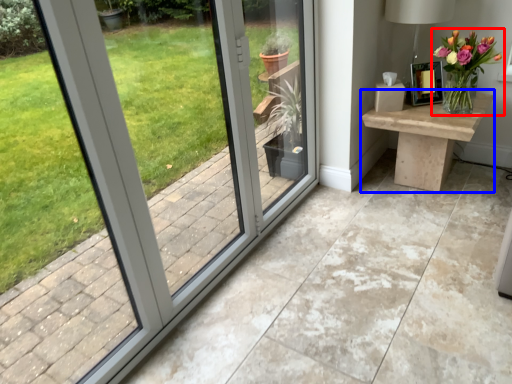
Question: Which object is closer to the camera taking this photo, houseplant (highlighted by a red box) or table (highlighted by a blue box)?

Choices:
 (A) houseplant
 (B) table

Answer: (A)